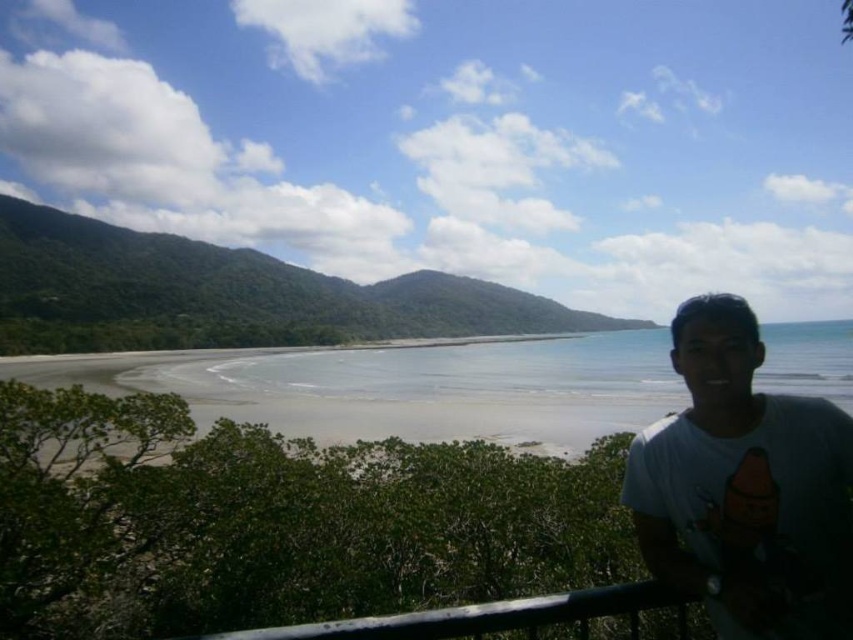
Can you confirm if white cotton t-shirt at right is smaller than black metal rail at lower right?

No, white cotton t-shirt at right is not smaller than black metal rail at lower right.

Can you confirm if white cotton t-shirt at right is positioned to the left of black metal rail at lower right?

In fact, white cotton t-shirt at right is to the right of black metal rail at lower right.

Where is `white cotton t-shirt at right`? This screenshot has height=640, width=853. white cotton t-shirt at right is located at coordinates (746, 486).